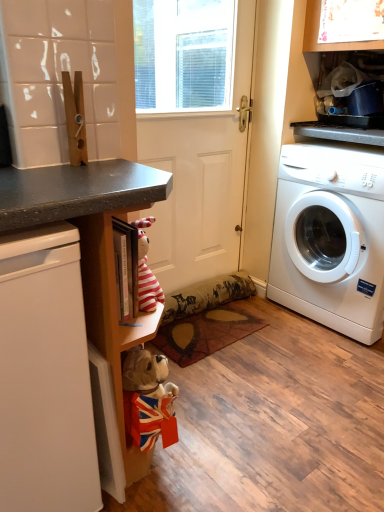
What is the approximate width of white matte dishwasher at left?

23.04 inches.

Image resolution: width=384 pixels, height=512 pixels. Describe the element at coordinates (45, 376) in the screenshot. I see `white matte dishwasher at left` at that location.

Find the location of `patterned fabric mat at center`. patterned fabric mat at center is located at coordinates tap(205, 333).

This screenshot has width=384, height=512. I want to click on white plastic washing machine at right, so tap(330, 237).

Find the location of a particular element. white matte dishwasher at left is located at coordinates (45, 376).

You are a GUI agent. You are given a task and a screenshot of the screen. Output one action in this format:
    pyautogui.click(x=<x>, y=<y>)
    Task: Click on the dish washer to the left of patterned fabric mat at center
    
    Given the screenshot: What is the action you would take?
    pyautogui.click(x=45, y=376)

Are white matte dishwasher at left and patterned fabric mat at center far apart?

Actually, white matte dishwasher at left and patterned fabric mat at center are a little close together.

From a real-world perspective, does white matte dishwasher at left sit lower than patterned fabric mat at center?

No, from a real-world perspective, white matte dishwasher at left is not beneath patterned fabric mat at center.

Which object is closer to the camera, white matte dishwasher at left or patterned fabric mat at center?

Positioned in front is white matte dishwasher at left.

Is white matte screen door at center far from white matte dishwasher at left?

Yes.

Measure the distance from white matte screen door at center to white matte dishwasher at left.

They are 3.80 feet apart.

You are a GUI agent. You are given a task and a screenshot of the screen. Output one action in this format:
    pyautogui.click(x=<x>, y=<y>)
    Task: Click on the screen door that appears above the white matte dishwasher at left (from the image's perspective)
    
    Given the screenshot: What is the action you would take?
    pyautogui.click(x=197, y=136)

From the image's perspective, is white matte screen door at center below white matte dishwasher at left?

Incorrect, from the image's perspective, white matte screen door at center is higher than white matte dishwasher at left.

Is point (372, 270) farther from viewer compared to point (38, 223)?

Yes, it is behind point (38, 223).

Is matte black counter at lower left at the back of white plastic washing machine at right?

No, matte black counter at lower left is not at the back of white plastic washing machine at right.

From the image's perspective, is white plastic washing machine at right above matte black counter at lower left?

Yes, from the image's perspective, white plastic washing machine at right is above matte black counter at lower left.

Are white plastic washing machine at right and matte black counter at lower left beside each other?

white plastic washing machine at right and matte black counter at lower left are not in contact.

From the image's perspective, between matte black counter at lower left and white plastic washing machine at right, which one is located above?

white plastic washing machine at right, from the image's perspective.

How much distance is there between matte black counter at lower left and white plastic washing machine at right?

matte black counter at lower left and white plastic washing machine at right are 1.12 meters apart.

Is matte black counter at lower left located outside white plastic washing machine at right?

Yes, matte black counter at lower left is outside of white plastic washing machine at right.

Which object is closer to the camera, matte black counter at lower left or white plastic washing machine at right?

matte black counter at lower left is closer to the camera.

Looking at their sizes, would you say white matte screen door at center is wider or thinner than matte black counter at lower left?

white matte screen door at center is thinner than matte black counter at lower left.

From a real-world perspective, which object stands above the other?

white matte screen door at center is physically above.

Would you say white matte screen door at center is outside matte black counter at lower left?

white matte screen door at center is positioned outside matte black counter at lower left.

Is patterned fabric mat at center in contact with white matte dishwasher at left?

No, patterned fabric mat at center is not touching white matte dishwasher at left.

Consider the image. Does patterned fabric mat at center lie in front of white matte dishwasher at left?

No, patterned fabric mat at center is further to the viewer.

From a real-world perspective, is patterned fabric mat at center positioned over white matte dishwasher at left based on gravity?

Incorrect, from a real-world perspective, patterned fabric mat at center is lower than white matte dishwasher at left.

From the image's perspective, between patterned fabric mat at center and white matte dishwasher at left, which one is located above?

white matte dishwasher at left.

Does white matte dishwasher at left have a larger size compared to white matte screen door at center?

Indeed, white matte dishwasher at left has a larger size compared to white matte screen door at center.

Is white matte dishwasher at left not close to white matte screen door at center?

Absolutely, white matte dishwasher at left is distant from white matte screen door at center.

Is white matte dishwasher at left taller or shorter than white matte screen door at center?

In the image, white matte dishwasher at left appears to be shorter than white matte screen door at center.

You are a GUI agent. You are given a task and a screenshot of the screen. Output one action in this format:
    pyautogui.click(x=<x>, y=<y>)
    Task: Click on the dish washer above the patterned fabric mat at center (from the image's perspective)
    The width and height of the screenshot is (384, 512).
    Given the screenshot: What is the action you would take?
    pos(45,376)

The width and height of the screenshot is (384, 512). I want to click on screen door that is on the right side of white matte dishwasher at left, so click(197, 136).

When comparing their distances from white matte screen door at center, does patterned fabric mat at center or white plastic washing machine at right seem closer?

patterned fabric mat at center is positioned closer to the anchor white matte screen door at center.

Which object lies further to the anchor point patterned fabric mat at center, white matte screen door at center or matte black counter at lower left?

Based on the image, matte black counter at lower left appears to be further to patterned fabric mat at center.

From the image, which object appears to be nearer to patterned fabric mat at center, white matte dishwasher at left or matte black counter at lower left?

Among the two, matte black counter at lower left is located nearer to patterned fabric mat at center.

Looking at this image, looking at the image, which one is located further to patterned fabric mat at center, white plastic washing machine at right or white matte screen door at center?

white plastic washing machine at right lies further to patterned fabric mat at center than the other object.

Looking at the image, which one is located further to patterned fabric mat at center, matte black counter at lower left or white matte dishwasher at left?

white matte dishwasher at left is further to patterned fabric mat at center.

Estimate the real-world distances between objects in this image. Which object is further from matte black counter at lower left, white plastic washing machine at right or white matte screen door at center?

white plastic washing machine at right lies further to matte black counter at lower left than the other object.

Based on their spatial positions, is patterned fabric mat at center or white matte dishwasher at left further from matte black counter at lower left?

patterned fabric mat at center lies further to matte black counter at lower left than the other object.

Which object lies nearer to the anchor point patterned fabric mat at center, white plastic washing machine at right or matte black counter at lower left?

The object closer to patterned fabric mat at center is white plastic washing machine at right.

Locate an element on the screen. Image resolution: width=384 pixels, height=512 pixels. dish washer located between matte black counter at lower left and patterned fabric mat at center in the depth direction is located at coordinates click(45, 376).

The width and height of the screenshot is (384, 512). I want to click on mat situated between white matte dishwasher at left and white plastic washing machine at right from left to right, so 205,333.

What are the coordinates of `counter located between white matte dishwasher at left and white plastic washing machine at right in the left-right direction` in the screenshot? It's located at (92, 248).

Locate an element on the screen. The height and width of the screenshot is (512, 384). washing machine between matte black counter at lower left and patterned fabric mat at center along the z-axis is located at coordinates (330, 237).